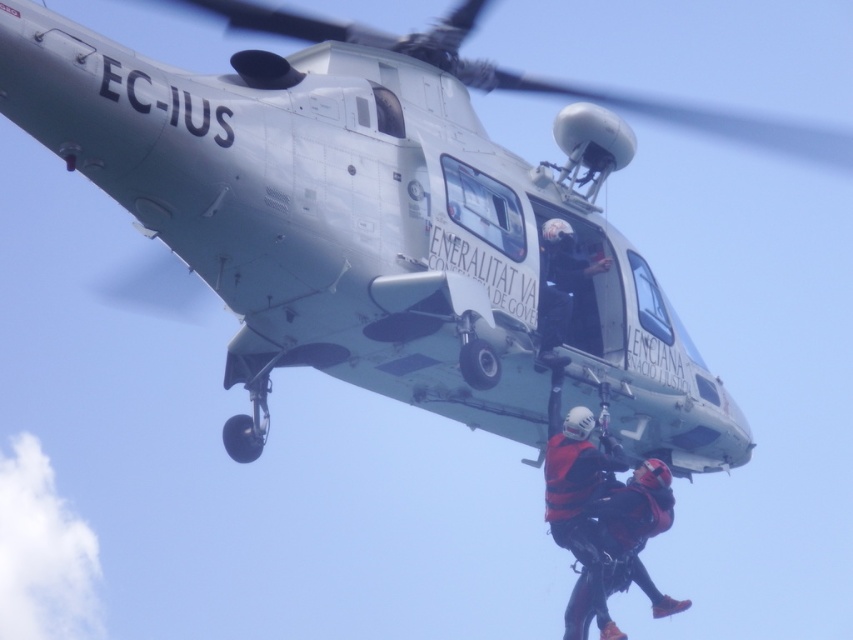
From the picture: Does red matte helmet at center have a lesser width compared to black helmet at upper center?

No.

Does red matte helmet at center have a greater width compared to black helmet at upper center?

Indeed, red matte helmet at center has a greater width compared to black helmet at upper center.

Is point (579, 579) farther from viewer compared to point (601, 264)?

That is False.

The height and width of the screenshot is (640, 853). Identify the location of red matte helmet at center. (x=634, y=531).

This screenshot has height=640, width=853. In order to click on red matte life vest at center in this screenshot , I will do `click(578, 490)`.

Is red matte life vest at center positioned before red matte helmet at center?

Yes, red matte life vest at center is closer to the viewer.

Is point (572, 432) in front of point (628, 532)?

Yes, point (572, 432) is in front of point (628, 532).

You are a GUI agent. You are given a task and a screenshot of the screen. Output one action in this format:
    pyautogui.click(x=<x>, y=<y>)
    Task: Click on the red matte life vest at center
    The width and height of the screenshot is (853, 640).
    Given the screenshot: What is the action you would take?
    pyautogui.click(x=578, y=490)

Can you confirm if red matte life vest at center is shorter than black helmet at upper center?

Incorrect, red matte life vest at center's height does not fall short of black helmet at upper center's.

Between point (590, 582) and point (549, 307), which one is positioned in front?

Positioned in front is point (549, 307).

I want to click on red matte life vest at center, so pyautogui.click(x=578, y=490).